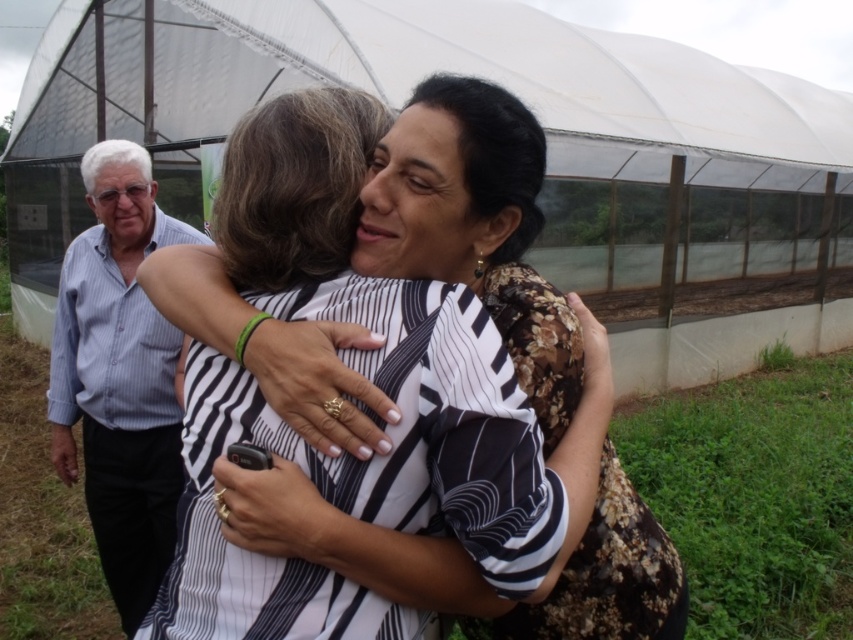
Is point (532, 506) behind point (128, 604)?

That is False.

Locate an element on the screen. This screenshot has width=853, height=640. striped fabric shirt at center is located at coordinates tap(387, 397).

Is point (457, 294) positioned behind point (172, 358)?

No, (457, 294) is in front of (172, 358).

This screenshot has width=853, height=640. Identify the location of striped fabric shirt at center. (387, 397).

Looking at this image, is black floral dress at center behind blue striped shirt at left?

No, black floral dress at center is in front of blue striped shirt at left.

Between point (613, 524) and point (83, 401), which one is positioned behind?

The point (83, 401) is more distant.

This screenshot has width=853, height=640. I want to click on black floral dress at center, so click(474, 227).

At what (x,y) coordinates should I click in order to perform the action: click on black floral dress at center. Please return your answer as a coordinate pair (x, y). The height and width of the screenshot is (640, 853). Looking at the image, I should click on (474, 227).

Which of these two, striped fabric shirt at center or black floral dress at center, stands taller?

black floral dress at center

Which is below, striped fabric shirt at center or black floral dress at center?

black floral dress at center is below.

Does point (352, 304) come closer to viewer compared to point (646, 605)?

Yes, it is in front of point (646, 605).

Find the location of a particular element. This screenshot has width=853, height=640. striped fabric shirt at center is located at coordinates (387, 397).